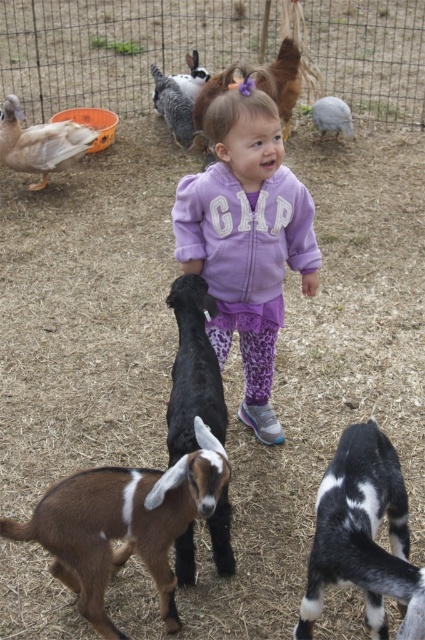
Does black smooth goat at center appear over matte white duck at upper left?

Incorrect, black smooth goat at center is not positioned above matte white duck at upper left.

Which is behind, point (193, 353) or point (48, 168)?

Positioned behind is point (48, 168).

Which is behind, point (192, 582) or point (84, 141)?

The point (84, 141) is behind.

The width and height of the screenshot is (425, 640). Find the location of `black smooth goat at center`. black smooth goat at center is located at coordinates (192, 369).

Measure the distance between brown fuzzy goat at lower left and black and white fur goat at center.

The distance of brown fuzzy goat at lower left from black and white fur goat at center is 18.16 inches.

Is the position of brown fuzzy goat at lower left less distant than that of black and white fur goat at center?

No, it is behind black and white fur goat at center.

Find the location of a particular element. The image size is (425, 640). brown fuzzy goat at lower left is located at coordinates (124, 524).

You are a GUI agent. You are given a task and a screenshot of the screen. Output one action in this format:
    pyautogui.click(x=<x>, y=<y>)
    Task: Click on the brown fuzzy goat at lower left
    Image resolution: width=425 pixels, height=640 pixels.
    Given the screenshot: What is the action you would take?
    pyautogui.click(x=124, y=524)

Does purple fleece sweatshirt at center have a lesser height compared to brown fuzzy goat at lower left?

Incorrect, purple fleece sweatshirt at center's height does not fall short of brown fuzzy goat at lower left's.

Between point (195, 182) and point (169, 547), which one is positioned in front?

Positioned in front is point (169, 547).

Is point (269, 424) positioned behind point (200, 508)?

Yes.

Locate an element on the screen. Image resolution: width=425 pixels, height=640 pixels. purple fleece sweatshirt at center is located at coordinates coord(246,230).